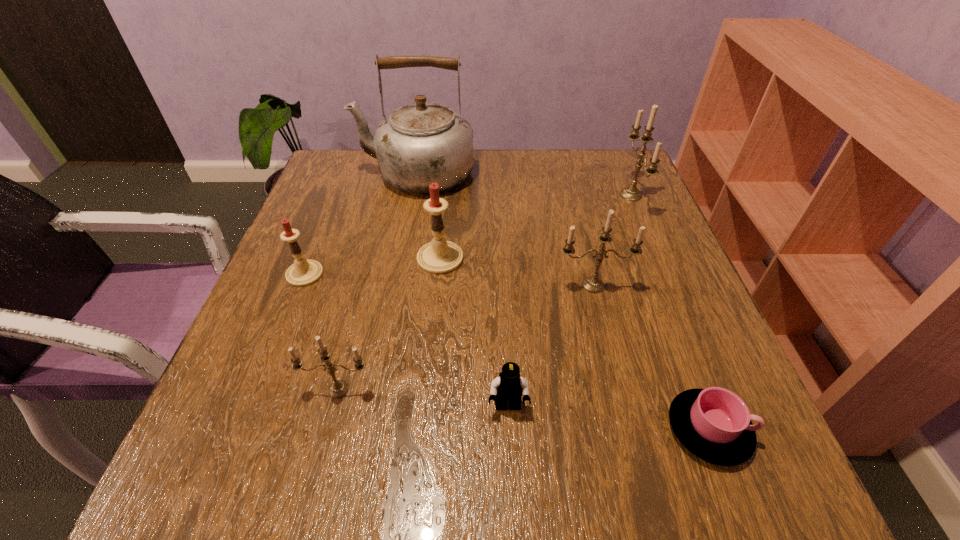
Find the location of a particular element. This screenshot has width=960, height=540. vacant space located 0.090m on the front-facing side of the fourth object from right to left is located at coordinates (512, 480).

Locate an element on the screen. This screenshot has width=960, height=540. kettle positioned at the far edge is located at coordinates (421, 143).

This screenshot has width=960, height=540. Find the location of `candle located in the far edge section of the desktop`. candle located in the far edge section of the desktop is located at coordinates (631, 193).

Locate an element on the screen. This screenshot has width=960, height=540. object that is at the near edge is located at coordinates (714, 424).

You are a GUI agent. You are given a task and a screenshot of the screen. Output one action in this format:
    pyautogui.click(x=<x>, y=<y>)
    Task: Click on the kettle at the left edge
    The height and width of the screenshot is (540, 960).
    Given the screenshot: What is the action you would take?
    pyautogui.click(x=421, y=143)

Where is `cup that is at the right edge`? This screenshot has height=540, width=960. cup that is at the right edge is located at coordinates (714, 424).

Image resolution: width=960 pixels, height=540 pixels. I want to click on object present at the far left corner, so click(x=421, y=143).

Identify the location of object that is at the far right corner. The width and height of the screenshot is (960, 540). (631, 193).

Where is `object at the near right corner`? Image resolution: width=960 pixels, height=540 pixels. object at the near right corner is located at coordinates (714, 424).

Where is `vacant region at the far edge of the desktop`? The height and width of the screenshot is (540, 960). vacant region at the far edge of the desktop is located at coordinates (551, 199).